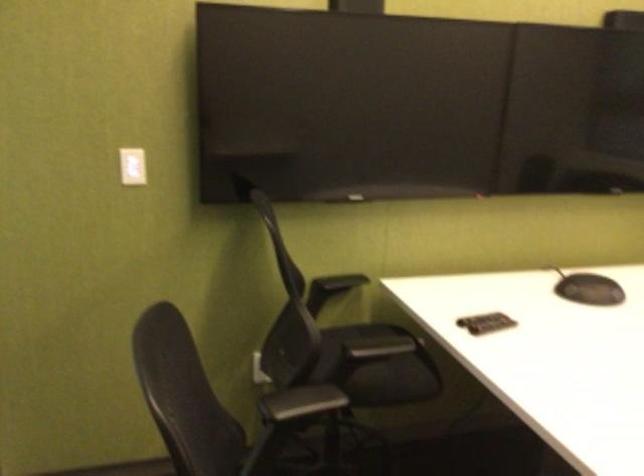
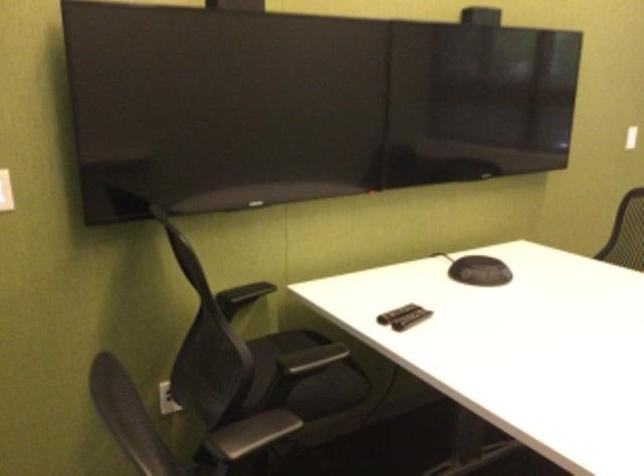
What movement of the cameraman would produce the second image?

The cameraman moved toward left, forward.